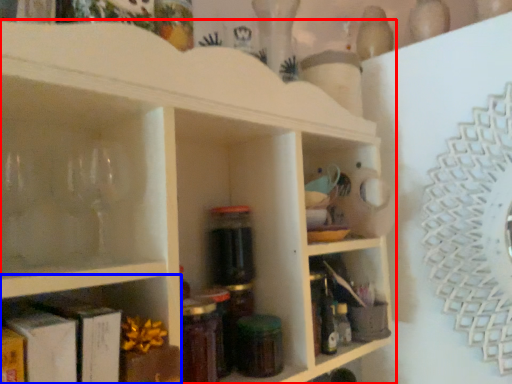
Question: Which point is closer to the camera, shelf (highlighted by a red box) or shelf (highlighted by a blue box)?

Choices:
 (A) shelf
 (B) shelf

Answer: (B)